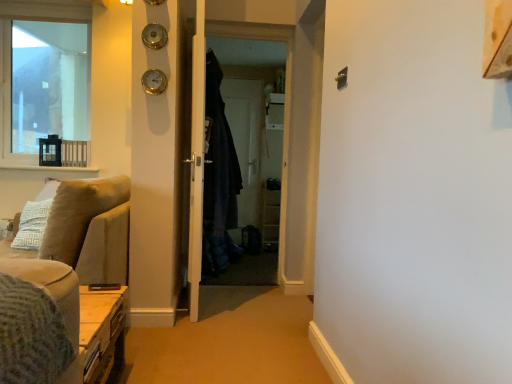
Question: Is beige fabric couch at left at the back of dark fabric screen door at center, which appears as the first screen door when viewed from the front?

Choices:
 (A) yes
 (B) no

Answer: (B)

Question: Does dark fabric screen door at center, which appears as the first screen door when viewed from the front, have a lesser height compared to beige fabric couch at left?

Choices:
 (A) yes
 (B) no

Answer: (B)

Question: Is dark fabric screen door at center, which is the 2th screen door from back to front, further to the viewer compared to beige fabric couch at left?

Choices:
 (A) yes
 (B) no

Answer: (A)

Question: Is dark fabric screen door at center, which appears as the first screen door when viewed from the front, not close to beige fabric couch at left?

Choices:
 (A) no
 (B) yes

Answer: (A)

Question: Considering the relative sizes of dark fabric screen door at center, which is the 2th screen door from back to front, and beige fabric couch at left in the image provided, is dark fabric screen door at center, which is the 2th screen door from back to front, thinner than beige fabric couch at left?

Choices:
 (A) no
 (B) yes

Answer: (B)

Question: Is dark fabric screen door at center, which appears as the first screen door when viewed from the front, positioned beyond the bounds of beige fabric couch at left?

Choices:
 (A) yes
 (B) no

Answer: (A)

Question: Can you confirm if dark blue fabric robe at center is smaller than green knitted blanket at lower left?

Choices:
 (A) no
 (B) yes

Answer: (A)

Question: Does dark blue fabric robe at center appear on the right side of green knitted blanket at lower left?

Choices:
 (A) yes
 (B) no

Answer: (A)

Question: Can you confirm if dark blue fabric robe at center is wider than green knitted blanket at lower left?

Choices:
 (A) no
 (B) yes

Answer: (B)

Question: Is dark blue fabric robe at center at the left side of green knitted blanket at lower left?

Choices:
 (A) yes
 (B) no

Answer: (B)

Question: Is dark blue fabric robe at center taller than green knitted blanket at lower left?

Choices:
 (A) yes
 (B) no

Answer: (A)

Question: Is dark blue fabric robe at center positioned beyond the bounds of green knitted blanket at lower left?

Choices:
 (A) yes
 (B) no

Answer: (A)

Question: From a real-world perspective, is beige fabric couch at left on dark fabric screen door at center, which appears as the first screen door when viewed from the front?

Choices:
 (A) yes
 (B) no

Answer: (B)